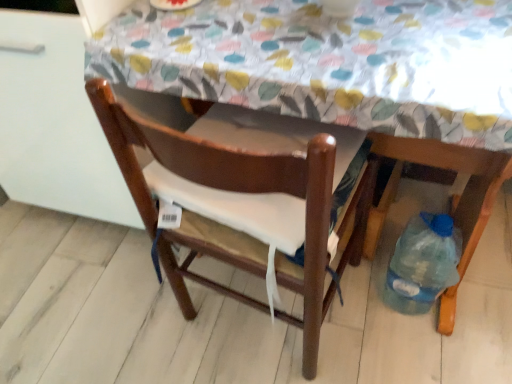
Find the location of a particular element. Image resolution: width=512 pixels, height=384 pixels. vacant area that lies to the right of wooden table at center is located at coordinates (407, 318).